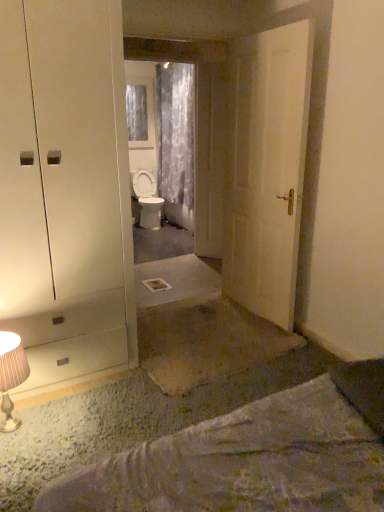
Question: Can you confirm if transparent glass mirror at center is taller than translucent floral fabric curtain at center?

Choices:
 (A) no
 (B) yes

Answer: (B)

Question: Is transparent glass mirror at center completely or partially outside of translucent floral fabric curtain at center?

Choices:
 (A) no
 (B) yes

Answer: (B)

Question: Can you confirm if transparent glass mirror at center is positioned to the right of translucent floral fabric curtain at center?

Choices:
 (A) yes
 (B) no

Answer: (B)

Question: Are transparent glass mirror at center and translucent floral fabric curtain at center far apart?

Choices:
 (A) no
 (B) yes

Answer: (A)

Question: Is transparent glass mirror at center looking in the opposite direction of translucent floral fabric curtain at center?

Choices:
 (A) yes
 (B) no

Answer: (B)

Question: Is point (3, 431) positioned closer to the camera than point (183, 155)?

Choices:
 (A) closer
 (B) farther

Answer: (A)

Question: From a real-world perspective, is metallic beige table lamp at lower left positioned above or below transparent glass mirror at center?

Choices:
 (A) below
 (B) above

Answer: (A)

Question: Based on their sizes in the image, would you say metallic beige table lamp at lower left is bigger or smaller than transparent glass mirror at center?

Choices:
 (A) big
 (B) small

Answer: (B)

Question: Would you say metallic beige table lamp at lower left is to the left or to the right of transparent glass mirror at center in the picture?

Choices:
 (A) left
 (B) right

Answer: (A)

Question: Based on their sizes in the image, would you say transparent glass mirror at center is bigger or smaller than translucent floral fabric curtain at center?

Choices:
 (A) big
 (B) small

Answer: (B)

Question: In terms of width, does transparent glass mirror at center look wider or thinner when compared to translucent floral fabric curtain at center?

Choices:
 (A) wide
 (B) thin

Answer: (B)

Question: Choose the correct answer: Is transparent glass mirror at center inside translucent floral fabric curtain at center or outside it?

Choices:
 (A) inside
 (B) outside

Answer: (B)

Question: Visually, is transparent glass mirror at center positioned to the left or to the right of translucent floral fabric curtain at center?

Choices:
 (A) left
 (B) right

Answer: (A)

Question: From the image's perspective, is white matte door at center, marked as the first door in a right-to-left arrangement, located above or below metallic beige table lamp at lower left?

Choices:
 (A) below
 (B) above

Answer: (B)

Question: Considering the positions of white matte door at center, the first door positioned from the front, and metallic beige table lamp at lower left in the image, is white matte door at center, the first door positioned from the front, bigger or smaller than metallic beige table lamp at lower left?

Choices:
 (A) big
 (B) small

Answer: (A)